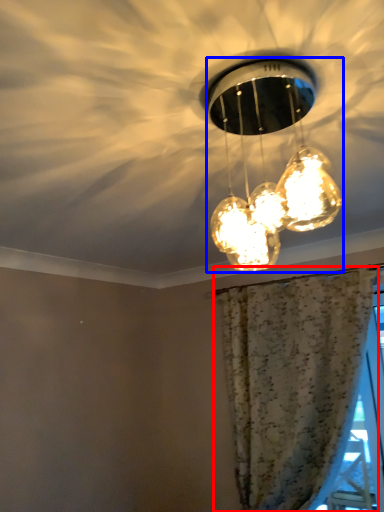
Question: Among these objects, which one is farthest to the camera, curtain (highlighted by a red box) or lamp (highlighted by a blue box)?

Choices:
 (A) curtain
 (B) lamp

Answer: (A)